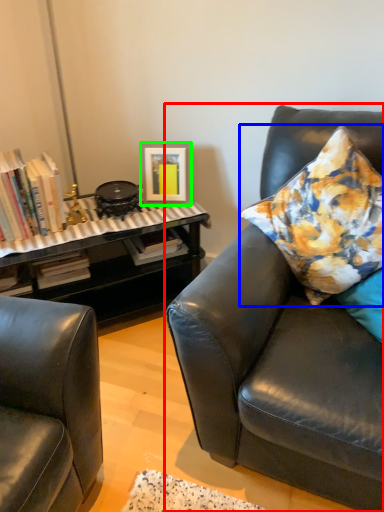
Question: Considering the real-world distances, which object is closest to studio couch (highlighted by a red box)? pillow (highlighted by a blue box) or picture frame (highlighted by a green box).

Choices:
 (A) pillow
 (B) picture frame

Answer: (A)